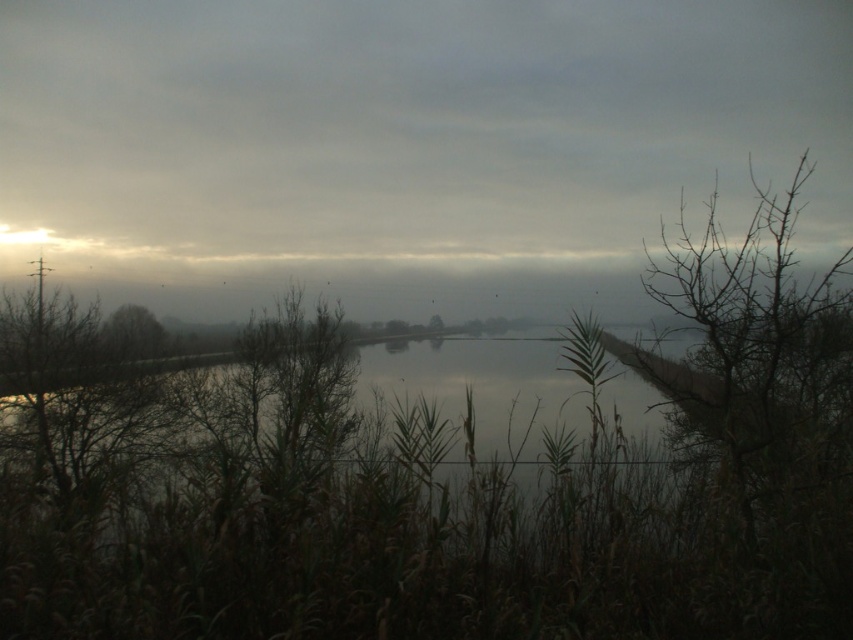
You are standing at the point with coordinates point (131, 333) in the image. What object are you standing on?

You are standing on the brown leafless tree at left.

You are standing at the edge of the water and want to walk towards the green leafy tree at center. Will the bare branches at right block your path?

The bare branches at right are positioned over the green leafy tree at center, so they might cast a shadow but won not block your path physically since they are above it.

Looking at this image, you are a bird flying over the serene landscape. You see the bare branches at right. Where exactly are they located in the image?

The bare branches at right are located at point (761, 346) in the image.